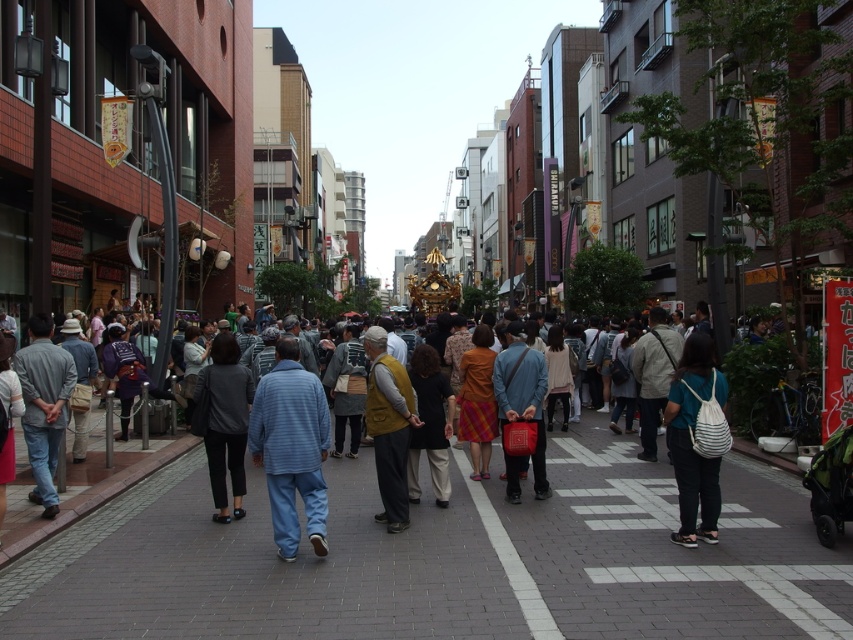
Question: Does blue striped shirt at center come in front of dark gray fabric pants at center?

Choices:
 (A) no
 (B) yes

Answer: (B)

Question: Which of the following is the farthest from the observer?

Choices:
 (A) mustard yellow vest at center
 (B) striped fabric backpack at center
 (C) blue striped shirt at center
 (D) brick pavement at center

Answer: (A)

Question: In this image, where is blue striped shirt at center located relative to mustard yellow vest at center?

Choices:
 (A) above
 (B) below

Answer: (B)

Question: Among these points, which one is farthest from the camera?

Choices:
 (A) click(x=395, y=358)
 (B) click(x=618, y=461)

Answer: (B)

Question: Estimate the real-world distances between objects in this image. Which object is closer to the striped fabric backpack at center?

Choices:
 (A) mustard yellow vest at center
 (B) blue striped shirt at center

Answer: (A)

Question: Is dark gray fabric pants at center positioned at the back of mustard yellow vest at center?

Choices:
 (A) no
 (B) yes

Answer: (B)